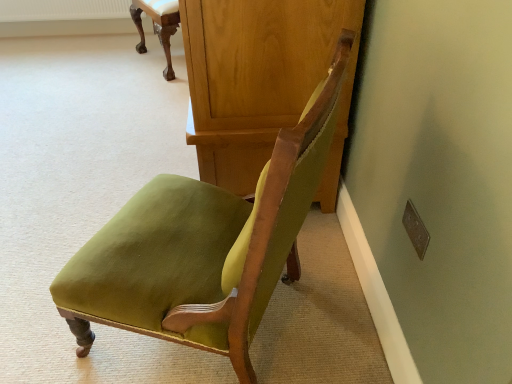
The image size is (512, 384). What are the coordinates of `wooden dresser at center` in the screenshot? It's located at (261, 81).

Who is shorter, matte green fabric chair at upper center, which ranks as the 1th chair in back-to-front order, or velvet green chair at center, which ranks as the 2th chair in top-to-bottom order?

matte green fabric chair at upper center, which ranks as the 1th chair in back-to-front order, is shorter.

How far apart are matte green fabric chair at upper center, which ranks as the 1th chair in back-to-front order, and velvet green chair at center, which ranks as the 2th chair in top-to-bottom order?

matte green fabric chair at upper center, which ranks as the 1th chair in back-to-front order, and velvet green chair at center, which ranks as the 2th chair in top-to-bottom order, are 6.73 feet apart from each other.

How many degrees apart are the facing directions of matte green fabric chair at upper center, acting as the 2th chair starting from the front, and velvet green chair at center, positioned as the second chair in back-to-front order?

The angular difference between matte green fabric chair at upper center, acting as the 2th chair starting from the front, and velvet green chair at center, positioned as the second chair in back-to-front order, is 55.7 degrees.

From a real-world perspective, does matte green fabric chair at upper center, the first chair when ordered from top to bottom, stand above velvet green chair at center, the 1th chair when ordered from bottom to top?

No.

Is velvet green chair at center, which ranks as the 2th chair in top-to-bottom order, completely or partially outside of wooden dresser at center?

That's correct, velvet green chair at center, which ranks as the 2th chair in top-to-bottom order, is outside of wooden dresser at center.

Is velvet green chair at center, positioned as the second chair in back-to-front order, thinner than wooden dresser at center?

In fact, velvet green chair at center, positioned as the second chair in back-to-front order, might be wider than wooden dresser at center.

Considering the positions of objects velvet green chair at center, positioned as the second chair in back-to-front order, and wooden dresser at center in the image provided, who is in front, velvet green chair at center, positioned as the second chair in back-to-front order, or wooden dresser at center?

velvet green chair at center, positioned as the second chair in back-to-front order, is more forward.

Which of these two, velvet green chair at center, the first chair from the front, or wooden dresser at center, is bigger?

With larger size is wooden dresser at center.

You are a GUI agent. You are given a task and a screenshot of the screen. Output one action in this format:
    pyautogui.click(x=<x>, y=<y>)
    Task: Click on the dresser above the matte green fabric chair at upper center, the second chair from the bottom (from a real-world perspective)
    Image resolution: width=512 pixels, height=384 pixels.
    Given the screenshot: What is the action you would take?
    [261, 81]

Is matte green fabric chair at upper center, acting as the 2th chair starting from the front, oriented away from wooden dresser at center?

That's not correct — matte green fabric chair at upper center, acting as the 2th chair starting from the front, is not looking away from wooden dresser at center.

Is matte green fabric chair at upper center, which ranks as the 1th chair in back-to-front order, next to wooden dresser at center?

No, matte green fabric chair at upper center, which ranks as the 1th chair in back-to-front order, is not touching wooden dresser at center.

From a real-world perspective, is matte green fabric chair at upper center, which ranks as the 1th chair in back-to-front order, positioned above or below wooden dresser at center?

matte green fabric chair at upper center, which ranks as the 1th chair in back-to-front order, is below wooden dresser at center.

Looking at the image, does wooden dresser at center seem bigger or smaller compared to velvet green chair at center, the 1th chair when ordered from bottom to top?

Considering their sizes, wooden dresser at center takes up more space than velvet green chair at center, the 1th chair when ordered from bottom to top.

In terms of height, does wooden dresser at center look taller or shorter compared to velvet green chair at center, the 1th chair when ordered from bottom to top?

Considering their sizes, wooden dresser at center has less height than velvet green chair at center, the 1th chair when ordered from bottom to top.

How much distance is there between wooden dresser at center and velvet green chair at center, the first chair from the front?

16.95 inches.

Is wooden dresser at center taller than matte green fabric chair at upper center, the first chair when ordered from top to bottom?

Yes, wooden dresser at center is taller than matte green fabric chair at upper center, the first chair when ordered from top to bottom.

Consider the image. Does wooden dresser at center come behind matte green fabric chair at upper center, the second chair from the bottom?

No, wooden dresser at center is in front of matte green fabric chair at upper center, the second chair from the bottom.

From a real-world perspective, relative to matte green fabric chair at upper center, the second chair from the bottom, is wooden dresser at center vertically above or below?

wooden dresser at center is situated higher than matte green fabric chair at upper center, the second chair from the bottom, in the real world.

Does point (308, 25) lie in front of point (137, 45)?

Yes, it is.

Is matte green fabric chair at upper center, the first chair when ordered from top to bottom, at the back of velvet green chair at center, the first chair from the front?

No, velvet green chair at center, the first chair from the front, is not facing away from matte green fabric chair at upper center, the first chair when ordered from top to bottom.

From the picture: Measure the distance from velvet green chair at center, the 1th chair when ordered from bottom to top, to matte green fabric chair at upper center, the first chair when ordered from top to bottom.

6.73 feet.

From the image's perspective, which object appears higher, velvet green chair at center, the first chair from the front, or matte green fabric chair at upper center, the second chair from the bottom?

matte green fabric chair at upper center, the second chair from the bottom, appears higher in the image.

Considering the positions of objects velvet green chair at center, the 1th chair when ordered from bottom to top, and matte green fabric chair at upper center, which ranks as the 1th chair in back-to-front order, in the image provided, who is more to the left, velvet green chair at center, the 1th chair when ordered from bottom to top, or matte green fabric chair at upper center, which ranks as the 1th chair in back-to-front order,?

matte green fabric chair at upper center, which ranks as the 1th chair in back-to-front order, is more to the left.

Image resolution: width=512 pixels, height=384 pixels. What are the coordinates of `chair on the right of the matte green fabric chair at upper center, the second chair from the bottom` in the screenshot? It's located at (203, 246).

You are a GUI agent. You are given a task and a screenshot of the screen. Output one action in this format:
    pyautogui.click(x=<x>, y=<y>)
    Task: Click on the chair in front of the wooden dresser at center
    
    Given the screenshot: What is the action you would take?
    pyautogui.click(x=203, y=246)

When comparing their distances from wooden dresser at center, does matte green fabric chair at upper center, the first chair when ordered from top to bottom, or velvet green chair at center, the first chair from the front, seem further?

The object further to wooden dresser at center is matte green fabric chair at upper center, the first chair when ordered from top to bottom.

From the image, which object appears to be nearer to matte green fabric chair at upper center, the second chair from the bottom, wooden dresser at center or velvet green chair at center, the first chair from the front?

wooden dresser at center.

When comparing their distances from matte green fabric chair at upper center, acting as the 2th chair starting from the front, does velvet green chair at center, positioned as the second chair in back-to-front order, or wooden dresser at center seem further?

velvet green chair at center, positioned as the second chair in back-to-front order, lies further to matte green fabric chair at upper center, acting as the 2th chair starting from the front, than the other object.

Estimate the real-world distances between objects in this image. Which object is further from velvet green chair at center, the first chair from the front, matte green fabric chair at upper center, acting as the 2th chair starting from the front, or wooden dresser at center?

matte green fabric chair at upper center, acting as the 2th chair starting from the front.

Looking at the image, which one is located further to velvet green chair at center, the first chair from the front, wooden dresser at center or matte green fabric chair at upper center, the second chair from the bottom?

matte green fabric chair at upper center, the second chair from the bottom, lies further to velvet green chair at center, the first chair from the front, than the other object.

Estimate the real-world distances between objects in this image. Which object is closer to wooden dresser at center, velvet green chair at center, the first chair from the front, or matte green fabric chair at upper center, the second chair from the bottom?

velvet green chair at center, the first chair from the front, lies closer to wooden dresser at center than the other object.

Where is `dresser between velvet green chair at center, the 1th chair when ordered from bottom to top, and matte green fabric chair at upper center, acting as the 2th chair starting from the front, along the z-axis`? dresser between velvet green chair at center, the 1th chair when ordered from bottom to top, and matte green fabric chair at upper center, acting as the 2th chair starting from the front, along the z-axis is located at coordinates (261, 81).